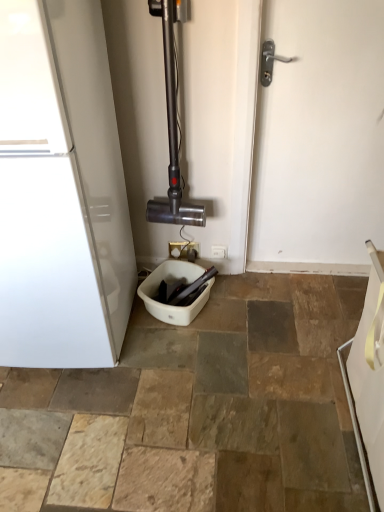
Question: Can you confirm if white matte door at center is wider than white glossy towel at lower right?

Choices:
 (A) yes
 (B) no

Answer: (B)

Question: Is white matte door at center thinner than white glossy towel at lower right?

Choices:
 (A) no
 (B) yes

Answer: (B)

Question: Considering the relative positions of white matte door at center and white glossy towel at lower right in the image provided, is white matte door at center to the right of white glossy towel at lower right from the viewer's perspective?

Choices:
 (A) yes
 (B) no

Answer: (B)

Question: Can you confirm if white matte door at center is taller than white glossy towel at lower right?

Choices:
 (A) no
 (B) yes

Answer: (B)

Question: Would you say white matte door at center is outside white glossy towel at lower right?

Choices:
 (A) yes
 (B) no

Answer: (A)

Question: Is white matte door at center in front of white glossy towel at lower right?

Choices:
 (A) no
 (B) yes

Answer: (A)

Question: From the image's perspective, would you say white glossy towel at lower right is positioned over white matte door at center?

Choices:
 (A) no
 (B) yes

Answer: (A)

Question: Is white glossy towel at lower right far from white matte door at center?

Choices:
 (A) yes
 (B) no

Answer: (B)

Question: Is white glossy towel at lower right facing towards white matte door at center?

Choices:
 (A) yes
 (B) no

Answer: (B)

Question: Can you confirm if white glossy towel at lower right is wider than white matte door at center?

Choices:
 (A) yes
 (B) no

Answer: (A)

Question: Does white glossy towel at lower right have a larger size compared to white matte door at center?

Choices:
 (A) yes
 (B) no

Answer: (A)

Question: From a real-world perspective, is white glossy towel at lower right positioned under white matte door at center based on gravity?

Choices:
 (A) yes
 (B) no

Answer: (A)

Question: From a real-world perspective, is white plastic toilet bowl at center on top of white plastic electric outlet at center, which is counted as the first electric outlet, starting from the left?

Choices:
 (A) no
 (B) yes

Answer: (A)